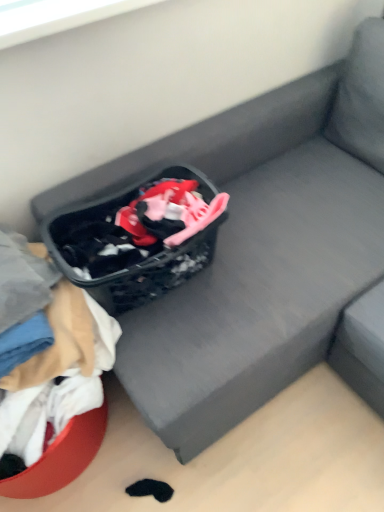
Question: From the image's perspective, relative to white cotton fabric at lower left, is black fabric shopping basket at center above or below?

Choices:
 (A) below
 (B) above

Answer: (B)

Question: Is black fabric shopping basket at center to the left or to the right of white cotton fabric at lower left in the image?

Choices:
 (A) right
 (B) left

Answer: (A)

Question: Is black fabric shopping basket at center situated inside white cotton fabric at lower left or outside?

Choices:
 (A) outside
 (B) inside

Answer: (A)

Question: Choose the correct answer: Is white cotton fabric at lower left inside black fabric shopping basket at center or outside it?

Choices:
 (A) inside
 (B) outside

Answer: (B)

Question: Considering their positions, is white cotton fabric at lower left located in front of or behind black fabric shopping basket at center?

Choices:
 (A) behind
 (B) front

Answer: (B)

Question: From the image's perspective, relative to black fabric shopping basket at center, is white cotton fabric at lower left above or below?

Choices:
 (A) below
 (B) above

Answer: (A)

Question: Looking at the image, does white cotton fabric at lower left seem bigger or smaller compared to black fabric shopping basket at center?

Choices:
 (A) small
 (B) big

Answer: (B)